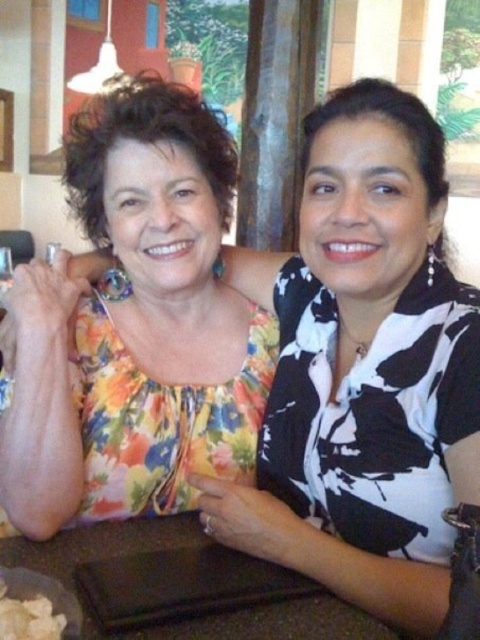
Does floral fabric blouse at upper left have a smaller size compared to white creamy food at lower left?

Actually, floral fabric blouse at upper left might be larger than white creamy food at lower left.

Between point (26, 513) and point (15, 608), which one is positioned in front?

Point (15, 608) is in front.

The width and height of the screenshot is (480, 640). What are the coordinates of `floral fabric blouse at upper left` in the screenshot? It's located at (132, 326).

Is floral fabric blouse at upper left positioned behind black matte table at lower center?

That is True.

The image size is (480, 640). Describe the element at coordinates (132, 326) in the screenshot. I see `floral fabric blouse at upper left` at that location.

I want to click on floral fabric blouse at upper left, so click(x=132, y=326).

Consider the image. Does black matte table at lower center appear on the right side of white creamy food at lower left?

Yes, black matte table at lower center is to the right of white creamy food at lower left.

Does black matte table at lower center have a greater height compared to white creamy food at lower left?

Indeed, black matte table at lower center has a greater height compared to white creamy food at lower left.

Is point (262, 621) closer to viewer compared to point (9, 620)?

That is False.

I want to click on black matte table at lower center, so click(264, 624).